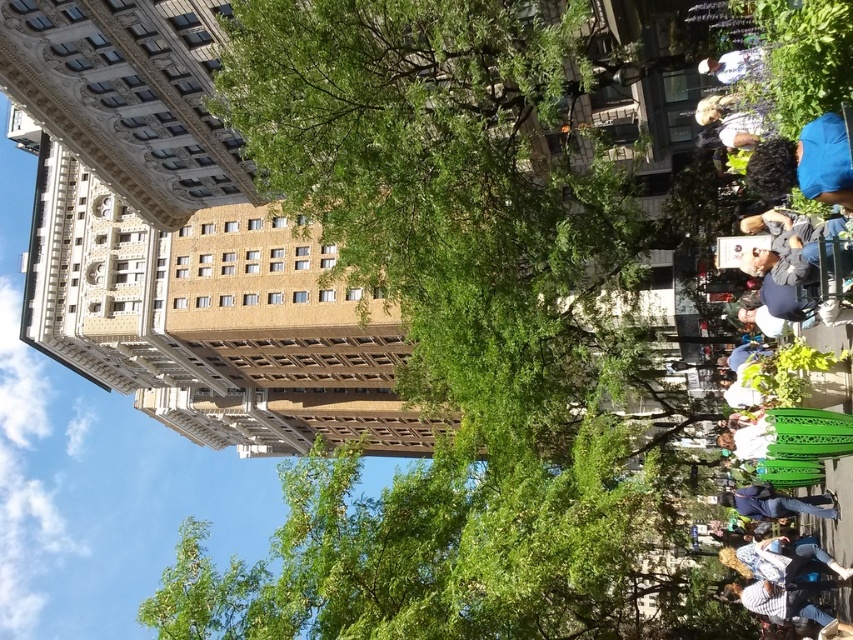
The image size is (853, 640). What are the coordinates of `blonde hair at upper right` in the screenshot? It's located at (726, 124).

Can you confirm if blonde hair at upper right is positioned above white fabric shirt at upper right?

Incorrect, blonde hair at upper right is not positioned above white fabric shirt at upper right.

Is point (756, 140) closer to camera compared to point (698, 68)?

Yes.

Locate an element on the screen. The height and width of the screenshot is (640, 853). blonde hair at upper right is located at coordinates (726, 124).

Is denim jacket at lower right positioned at the back of white fabric shirt at upper right?

No, it is in front of white fabric shirt at upper right.

Who is positioned more to the left, denim jacket at lower right or white fabric shirt at upper right?

white fabric shirt at upper right is more to the left.

Does point (776, 515) come closer to viewer compared to point (730, 54)?

Yes.

This screenshot has width=853, height=640. Identify the location of denim jacket at lower right. point(776,502).

Does green leafy tree at center have a smaller size compared to blue fabric at upper right?

No, green leafy tree at center is not smaller than blue fabric at upper right.

The image size is (853, 640). I want to click on green leafy tree at center, so click(453, 332).